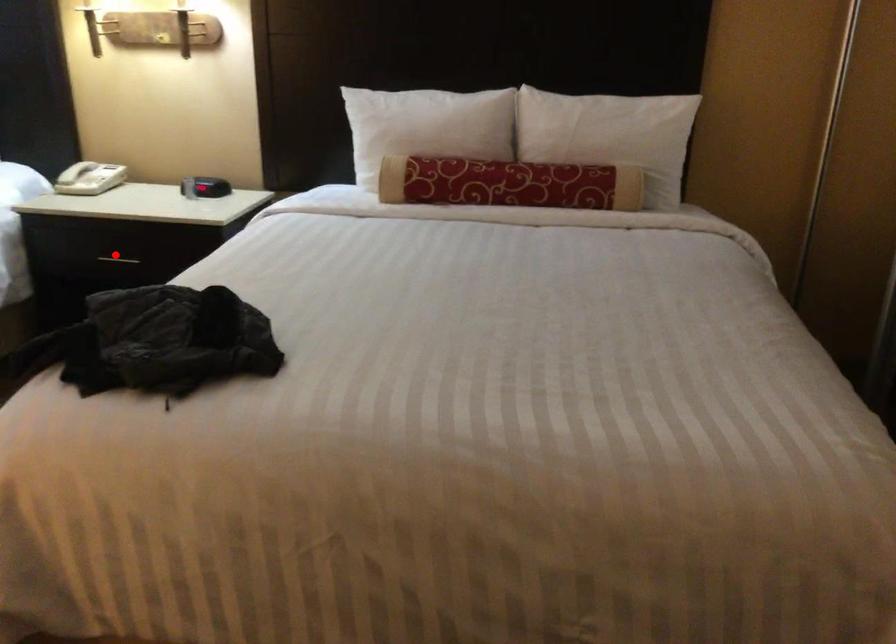
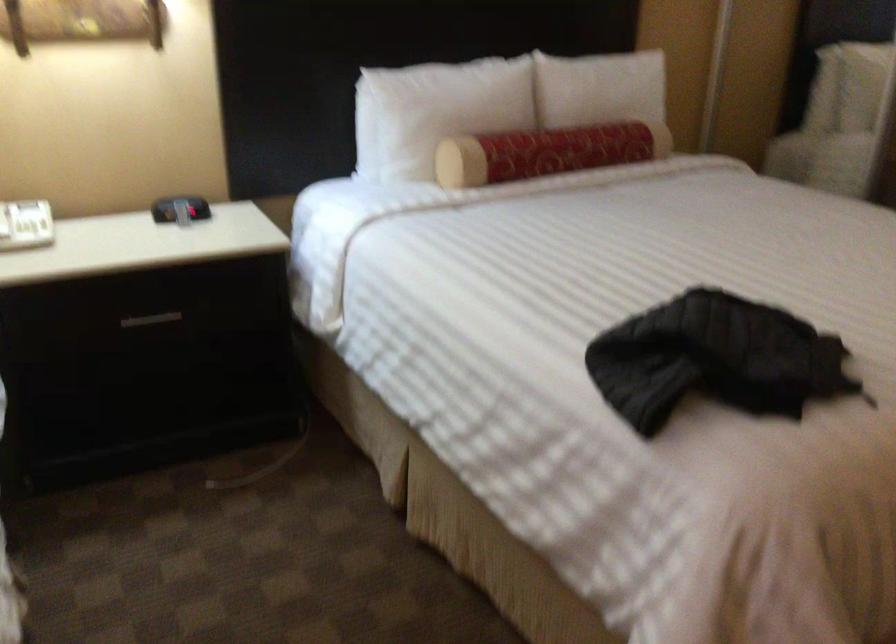
Question: I am providing you with two images of the same scene from different viewpoints. A red point is marked on the first image. Can you still see the location of the red point in image 2?

Choices:
 (A) Yes
 (B) No

Answer: (A)